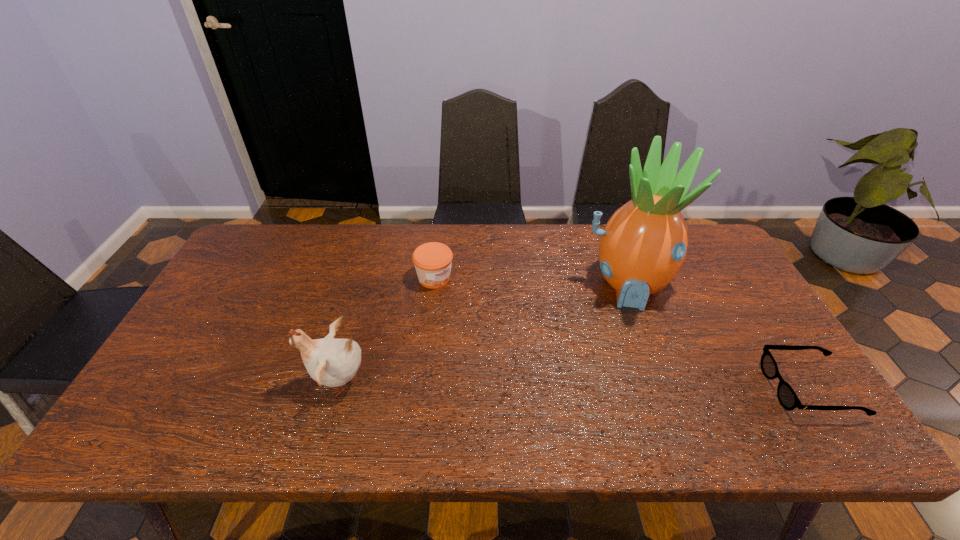
Locate an element on the screen. vacant space on the desktop that is between the bird and the rightmost object and is positioned on the front label of the jam is located at coordinates (574, 384).

Find the location of `vacant space on the desktop that is between the second tallest object and the shortest object and is positioned at the entrance of the third object from left to right`. vacant space on the desktop that is between the second tallest object and the shortest object and is positioned at the entrance of the third object from left to right is located at coordinates (636, 386).